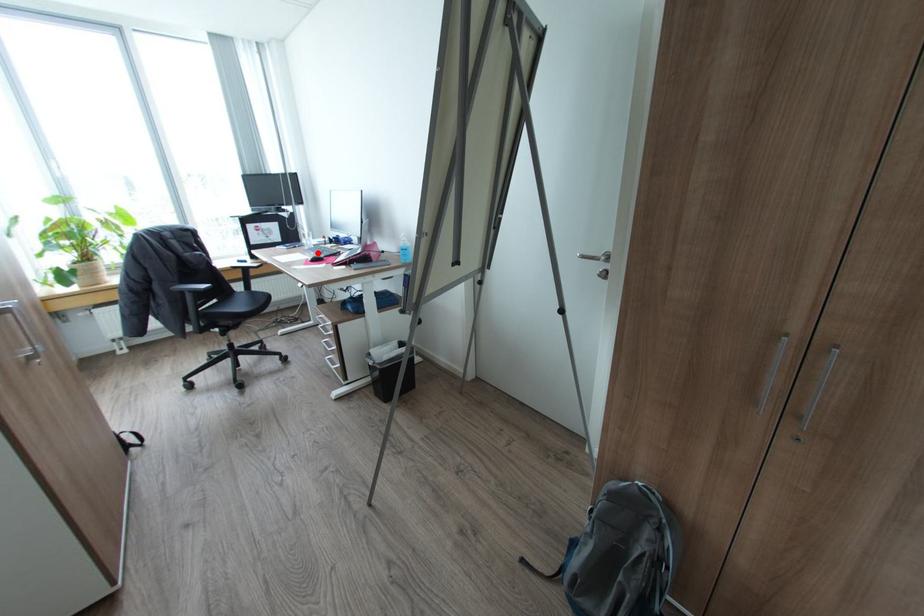
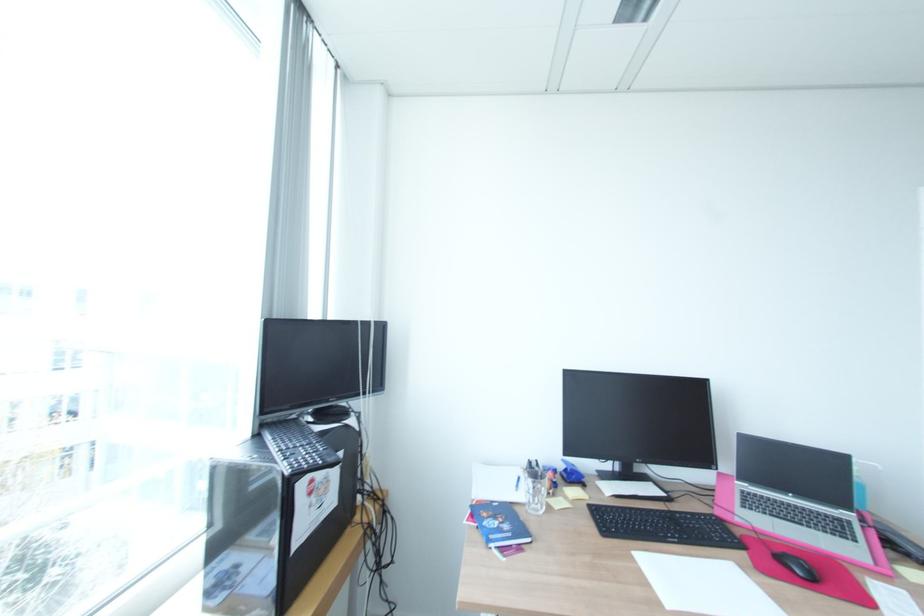
Question: I am providing you with two images of the same scene from different viewpoints. A red point is marked on the first image. At the location where the point appears in image 1, is it still visible in image 2?

Choices:
 (A) Yes
 (B) No

Answer: (A)